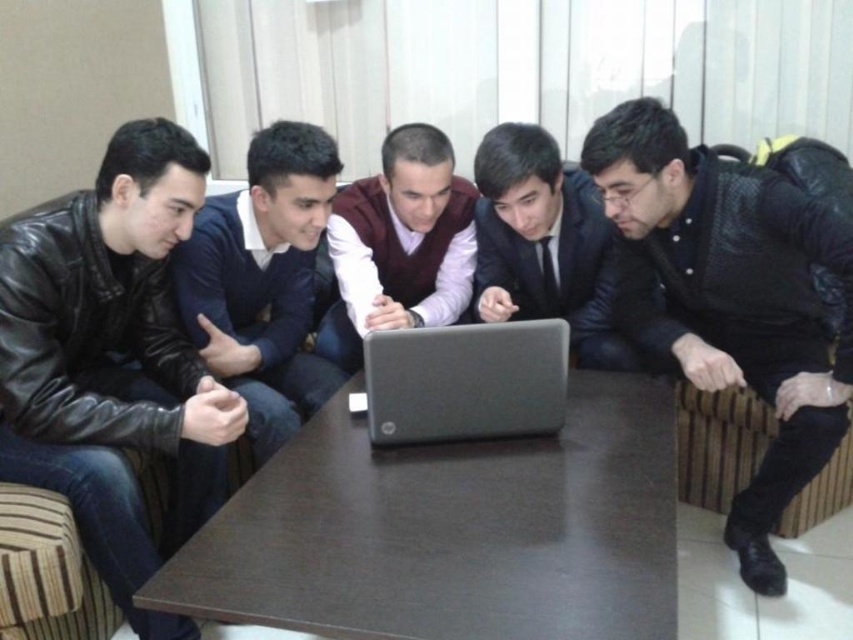
Which is more to the right, brown matte table at center or leather jacket at left?

From the viewer's perspective, brown matte table at center appears more on the right side.

Does brown matte table at center have a greater width compared to leather jacket at left?

Correct, the width of brown matte table at center exceeds that of leather jacket at left.

Between point (524, 518) and point (161, 308), which one is positioned in front?

Point (524, 518)

You are a GUI agent. You are given a task and a screenshot of the screen. Output one action in this format:
    pyautogui.click(x=<x>, y=<y>)
    Task: Click on the brown matte table at center
    This screenshot has width=853, height=640.
    Given the screenshot: What is the action you would take?
    pyautogui.click(x=451, y=531)

Does brown matte table at center come in front of black leather jacket at lower right?

Yes.

Does point (279, 458) come in front of point (837, 344)?

Yes, it is in front of point (837, 344).

Is point (492, 449) more distant than point (756, 305)?

No, it is in front of (756, 305).

The height and width of the screenshot is (640, 853). What are the coordinates of `brown matte table at center` in the screenshot? It's located at (451, 531).

Find the location of a particular element. The image size is (853, 640). matte black suit at center is located at coordinates pos(544,244).

This screenshot has width=853, height=640. What are the coordinates of `matte black suit at center` in the screenshot? It's located at (544, 244).